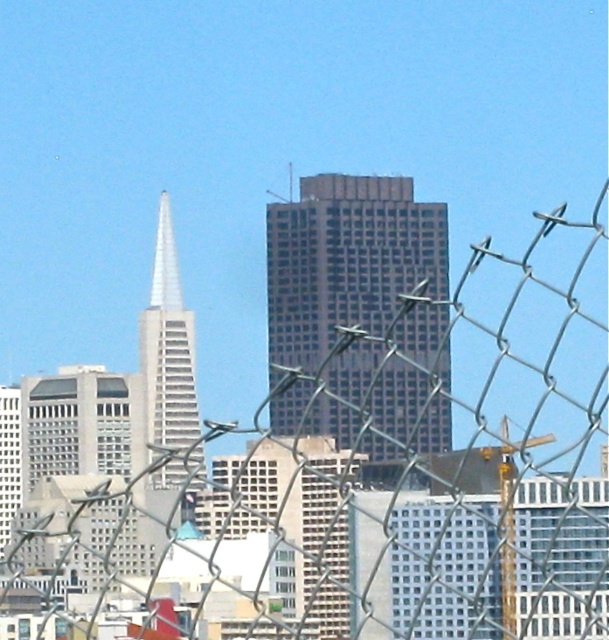
Question: Which of the following is the farthest from the observer?

Choices:
 (A) (174, 275)
 (B) (160, 214)
 (C) (353, 426)

Answer: (B)

Question: Can you confirm if dark glass skyscraper at center is thinner than silver glass tower at center?

Choices:
 (A) no
 (B) yes

Answer: (A)

Question: Which of the following is the closest to the observer?

Choices:
 (A) (183, 326)
 (B) (498, 314)
 (C) (157, 296)
 (D) (420, 392)

Answer: (C)

Question: Is silver glass tower at center smaller than shiny silver spire at center?

Choices:
 (A) yes
 (B) no

Answer: (B)

Question: Which of the following is the farthest from the observer?

Choices:
 (A) (448, 563)
 (B) (406, 422)

Answer: (A)

Question: Does dark glass skyscraper at center have a lesser width compared to shiny silver spire at center?

Choices:
 (A) yes
 (B) no

Answer: (B)